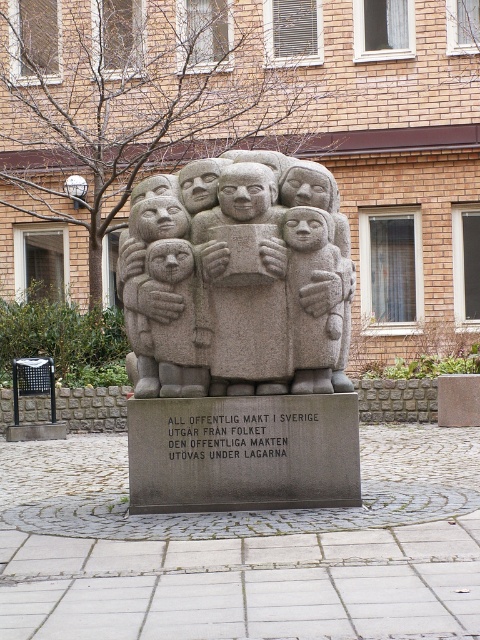
You are an art student analyzing the sculpture. You notice two elements, the granite statue at center and the gray stone child at center. Which one is placed higher up?

The granite statue at center is positioned over the gray stone child at center, so it is placed higher up.

You are standing in front of the sculpture and want to take a photo of the gray stone child at center. Since the granite sculpture at center is blocking your view, can you move to the side to get a clear shot?

The granite sculpture at center is closer to the viewer than the gray stone child at center, so moving to the side might allow you to see around the sculpture and capture the gray stone child at center in your photo.